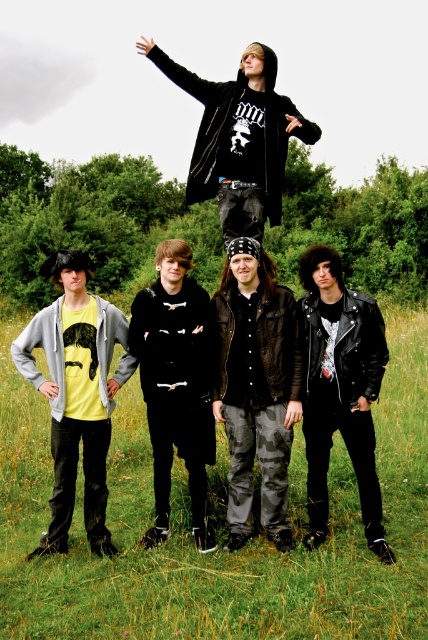
You are a photographer trying to capture a photo of the group. You need to ensure that both the leather jacket at lower right and the black leather jacket at upper center are visible in your shot. Which jacket will appear smaller in the photo?

The leather jacket at lower right will appear smaller in the photo because it has a lesser height compared to the black leather jacket at upper center.

You are a photographer trying to capture a clear shot of the two people wearing leather jackets in the image. The leather jacket at lower right is part of the base group, and the black leather jacket at upper center is part of the pyramid formation. Which jacket is closer to the camera?

The black leather jacket at upper center is closer to the camera because it is positioned above the leather jacket at lower right, which is beneath it.

You are standing in the grassy field and want to place a picnic blanket. The picnic blanket is as wide as the black leather jacket at upper center. Can the picnic blanket fit entirely within the green grass at lower center area?

The green grass at lower center might be wider than the black leather jacket at upper center, so the picnic blanket, which is as wide as the jacket, could fit within the grass area.